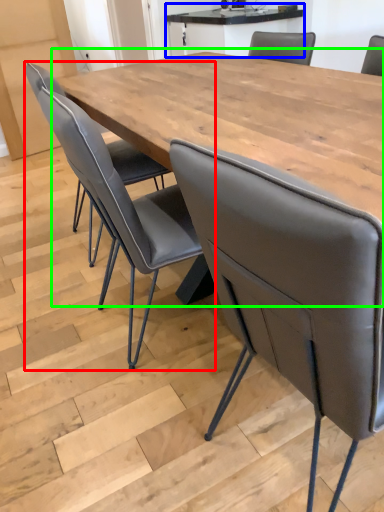
Question: Based on their relative distances, which object is farther from chair (highlighted by a red box)? Choose from table (highlighted by a blue box) and table (highlighted by a green box).

Choices:
 (A) table
 (B) table

Answer: (A)